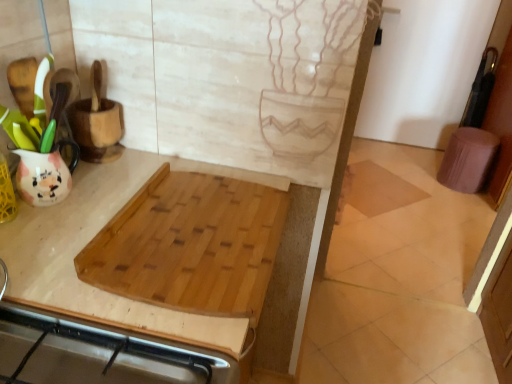
Question: Can we say purple fabric step stool at right lies outside natural wood cutting board at upper left?

Choices:
 (A) no
 (B) yes

Answer: (B)

Question: Is there a large distance between purple fabric step stool at right and natural wood cutting board at upper left?

Choices:
 (A) yes
 (B) no

Answer: (A)

Question: From the image's perspective, does purple fabric step stool at right appear lower than natural wood cutting board at upper left?

Choices:
 (A) no
 (B) yes

Answer: (A)

Question: Is purple fabric step stool at right closer to the viewer compared to natural wood cutting board at upper left?

Choices:
 (A) yes
 (B) no

Answer: (B)

Question: Is purple fabric step stool at right bigger than natural wood cutting board at upper left?

Choices:
 (A) no
 (B) yes

Answer: (A)

Question: Considering the positions of natural wood cutting board at upper left and natural wood cutting board at center in the image, is natural wood cutting board at upper left taller or shorter than natural wood cutting board at center?

Choices:
 (A) short
 (B) tall

Answer: (B)

Question: Based on their positions, is natural wood cutting board at upper left located to the left or right of natural wood cutting board at center?

Choices:
 (A) right
 (B) left

Answer: (B)

Question: From a real-world perspective, is natural wood cutting board at upper left above or below natural wood cutting board at center?

Choices:
 (A) below
 (B) above

Answer: (A)

Question: Is natural wood cutting board at upper left inside or outside of natural wood cutting board at center?

Choices:
 (A) inside
 (B) outside

Answer: (B)

Question: Considering their positions, is natural wood cutting board at upper left located in front of or behind beige tile at center?

Choices:
 (A) front
 (B) behind

Answer: (A)

Question: From a real-world perspective, relative to beige tile at center, is natural wood cutting board at upper left vertically above or below?

Choices:
 (A) below
 (B) above

Answer: (B)

Question: Does point (307, 241) appear closer or farther from the camera than point (416, 193)?

Choices:
 (A) farther
 (B) closer

Answer: (B)

Question: Is natural wood cutting board at upper left taller or shorter than beige tile at center?

Choices:
 (A) short
 (B) tall

Answer: (B)

Question: In terms of height, does natural wood cutting board at center look taller or shorter compared to beige tile at center?

Choices:
 (A) short
 (B) tall

Answer: (B)

Question: Is natural wood cutting board at center spatially inside beige tile at center, or outside of it?

Choices:
 (A) outside
 (B) inside

Answer: (A)